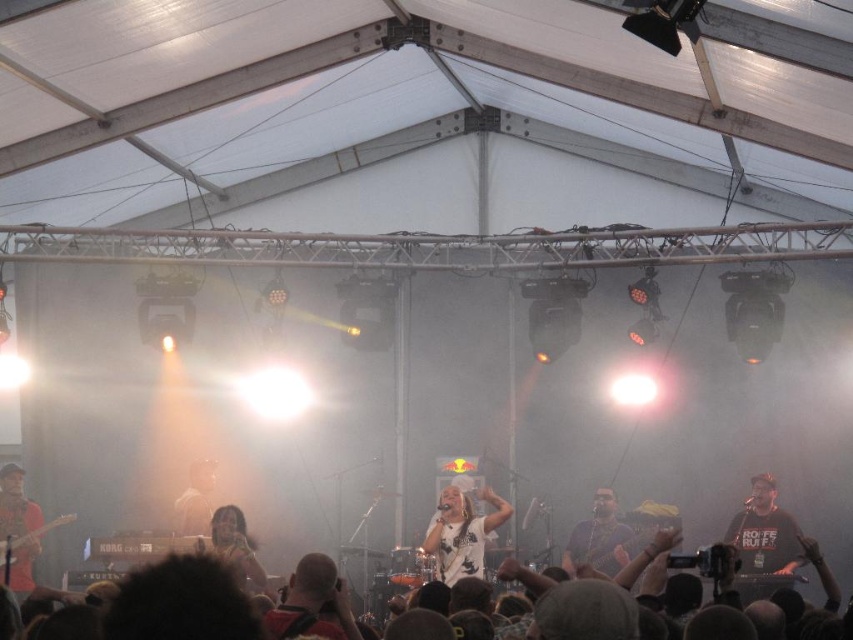
You are a photographer positioned at the camera location. You want to capture a closeup shot of the point at coordinates point [753,541] and point [22,547]. Which point will appear larger in your photo?

Point [753,541] is closer to the camera than point [22,547], so it will appear larger in the photo.

You are a photographer at the concert and want to capture both the black matte shirt at center and the shiny black shirt at center in a single shot. Which shirt should you focus on first to ensure both are in frame?

The black matte shirt at center is much taller than the shiny black shirt at center, so focusing on the taller one first will help ensure both are in frame.